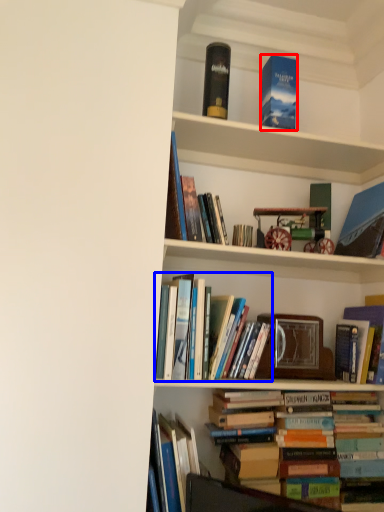
Question: Which of the following is the closest to the observer, book (highlighted by a red box) or book (highlighted by a blue box)?

Choices:
 (A) book
 (B) book

Answer: (B)